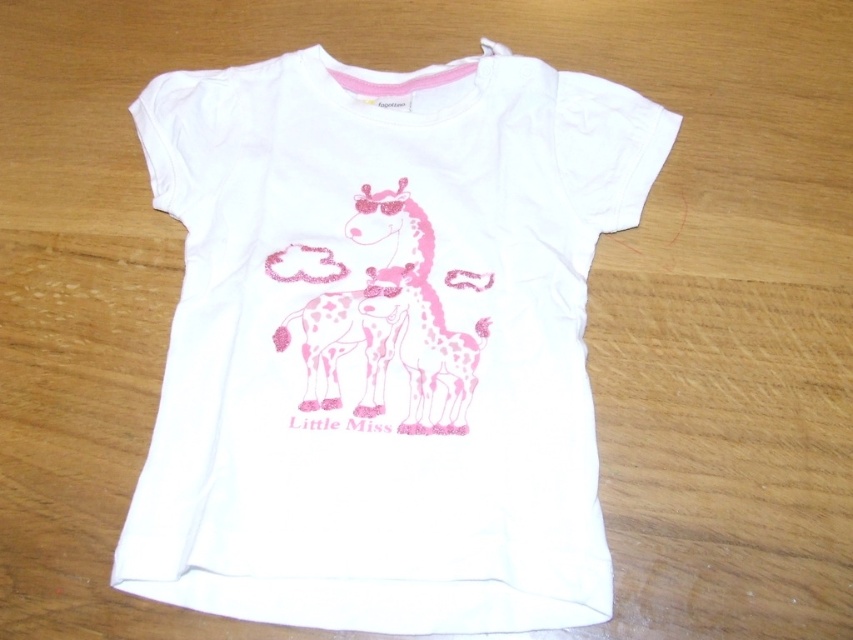
Question: Considering the relative positions of white matte t-shirt at center and pink glittery giraffe at center in the image provided, where is white matte t-shirt at center located with respect to pink glittery giraffe at center?

Choices:
 (A) left
 (B) right

Answer: (A)

Question: Can you confirm if white matte t-shirt at center is positioned to the right of pink glittery giraffe at center?

Choices:
 (A) no
 (B) yes

Answer: (A)

Question: Can you confirm if white matte t-shirt at center is positioned above pink glittery giraffe at center?

Choices:
 (A) no
 (B) yes

Answer: (B)

Question: Among these points, which one is farthest from the camera?

Choices:
 (A) (538, 150)
 (B) (418, 330)

Answer: (A)